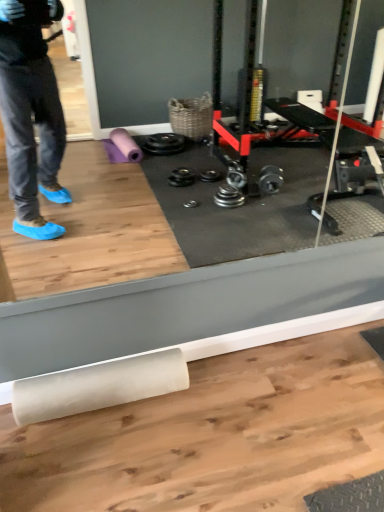
This screenshot has width=384, height=512. Identify the location of vacant space in front of white matte paper towel at lower center. (96, 461).